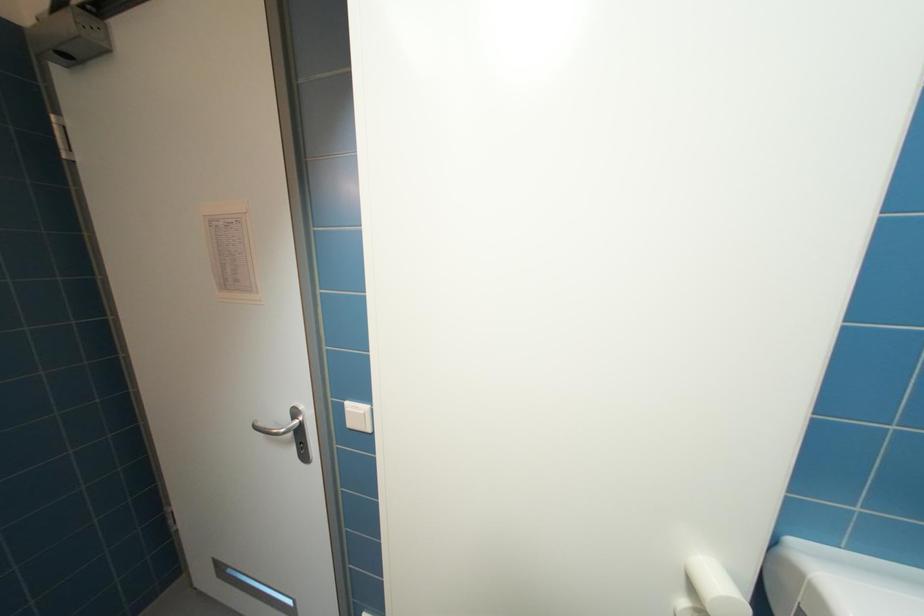
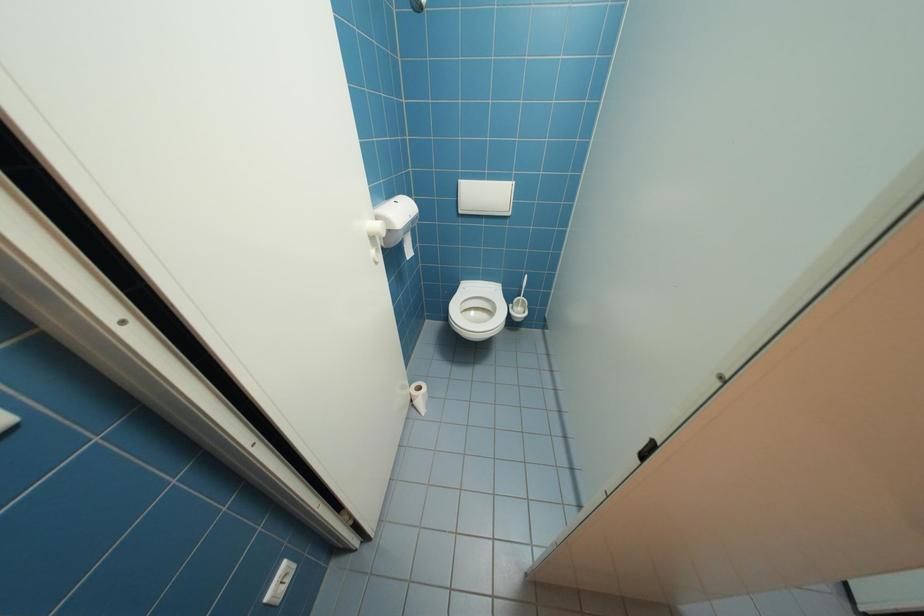
The images are taken continuously from a first-person perspective. In which direction is your viewpoint rotating?

The camera rotated toward right-down.